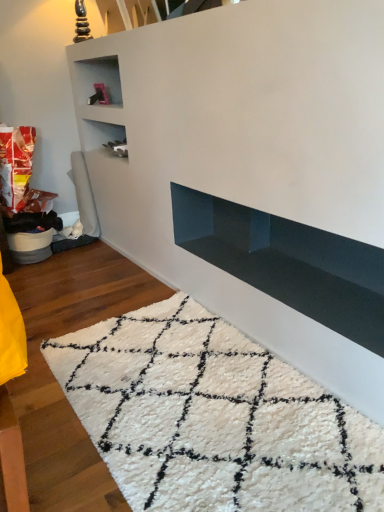
Question: Should I look upward or downward to see white shaggy rug at lower center?

Choices:
 (A) down
 (B) up

Answer: (A)

Question: Is white shaggy rug at lower center to the right of glossy dark blue shelf at lower center from the viewer's perspective?

Choices:
 (A) no
 (B) yes

Answer: (A)

Question: Considering the relative sizes of white shaggy rug at lower center and glossy dark blue shelf at lower center in the image provided, is white shaggy rug at lower center bigger than glossy dark blue shelf at lower center?

Choices:
 (A) yes
 (B) no

Answer: (A)

Question: Can you confirm if white shaggy rug at lower center is thinner than glossy dark blue shelf at lower center?

Choices:
 (A) no
 (B) yes

Answer: (A)

Question: Considering the relative sizes of white shaggy rug at lower center and glossy dark blue shelf at lower center in the image provided, is white shaggy rug at lower center shorter than glossy dark blue shelf at lower center?

Choices:
 (A) no
 (B) yes

Answer: (B)

Question: Is white shaggy rug at lower center not close to glossy dark blue shelf at lower center?

Choices:
 (A) yes
 (B) no

Answer: (B)

Question: From a real-world perspective, does white shaggy rug at lower center stand above glossy dark blue shelf at lower center?

Choices:
 (A) yes
 (B) no

Answer: (B)

Question: Does glossy dark blue shelf at lower center touch white shaggy rug at lower center?

Choices:
 (A) yes
 (B) no

Answer: (B)

Question: Does glossy dark blue shelf at lower center have a lesser height compared to white shaggy rug at lower center?

Choices:
 (A) no
 (B) yes

Answer: (A)

Question: Is glossy dark blue shelf at lower center behind white shaggy rug at lower center?

Choices:
 (A) no
 (B) yes

Answer: (B)

Question: Does glossy dark blue shelf at lower center have a greater height compared to white shaggy rug at lower center?

Choices:
 (A) no
 (B) yes

Answer: (B)

Question: Is glossy dark blue shelf at lower center oriented towards white shaggy rug at lower center?

Choices:
 (A) yes
 (B) no

Answer: (B)

Question: From a real-world perspective, is glossy dark blue shelf at lower center physically below white shaggy rug at lower center?

Choices:
 (A) yes
 (B) no

Answer: (B)

Question: Is glossy dark blue shelf at lower center in front of or behind white shaggy rug at lower center in the image?

Choices:
 (A) front
 (B) behind

Answer: (B)